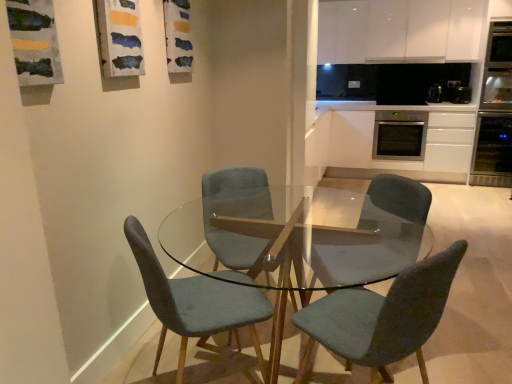
Question: Is white matte cabinet at upper center, which is counted as the 1th cabinetry, starting from the top, at the left side of satin white cabinet at right, acting as the 2th cabinetry starting from the top?

Choices:
 (A) yes
 (B) no

Answer: (A)

Question: Is white matte cabinet at upper center, which is counted as the 1th cabinetry, starting from the top, oriented away from satin white cabinet at right, acting as the first cabinetry starting from the bottom?

Choices:
 (A) yes
 (B) no

Answer: (B)

Question: Can you confirm if white matte cabinet at upper center, which is counted as the second cabinetry, starting from the bottom, is bigger than satin white cabinet at right, acting as the first cabinetry starting from the bottom?

Choices:
 (A) yes
 (B) no

Answer: (B)

Question: Does white matte cabinet at upper center, which is counted as the 1th cabinetry, starting from the top, have a lesser height compared to satin white cabinet at right, acting as the first cabinetry starting from the bottom?

Choices:
 (A) yes
 (B) no

Answer: (A)

Question: From the image's perspective, is white matte cabinet at upper center, which is counted as the 1th cabinetry, starting from the top, below satin white cabinet at right, acting as the 2th cabinetry starting from the top?

Choices:
 (A) yes
 (B) no

Answer: (B)

Question: Is white matte cabinet at upper center, which is counted as the second cabinetry, starting from the bottom, at the right side of satin white cabinet at right, acting as the first cabinetry starting from the bottom?

Choices:
 (A) yes
 (B) no

Answer: (B)

Question: Considering the relative sizes of satin black oven at right, which is the 1th appliance from left to right, and velvet teal chair at center, the first chair viewed from the right, in the image provided, is satin black oven at right, which is the 1th appliance from left to right, shorter than velvet teal chair at center, the first chair viewed from the right,?

Choices:
 (A) yes
 (B) no

Answer: (A)

Question: From a real-world perspective, is satin black oven at right, placed as the 3th appliance when sorted from right to left, physically below velvet teal chair at center, the third chair when ordered from left to right?

Choices:
 (A) yes
 (B) no

Answer: (B)

Question: Is satin black oven at right, which is the 1th appliance from left to right, aimed at velvet teal chair at center, the first chair viewed from the right?

Choices:
 (A) yes
 (B) no

Answer: (A)

Question: From the image's perspective, is satin black oven at right, placed as the 3th appliance when sorted from right to left, above velvet teal chair at center, the third chair when ordered from left to right?

Choices:
 (A) no
 (B) yes

Answer: (B)

Question: Can you confirm if satin black oven at right, placed as the 3th appliance when sorted from right to left, is thinner than velvet teal chair at center, the first chair viewed from the right?

Choices:
 (A) yes
 (B) no

Answer: (A)

Question: Is the position of satin black oven at right, which is the 1th appliance from left to right, less distant than that of velvet teal chair at center, the third chair when ordered from left to right?

Choices:
 (A) no
 (B) yes

Answer: (A)

Question: Considering the relative sizes of stainless steel oven at center-right and black plastic toaster at upper right, acting as the 2th appliance starting from the left, in the image provided, is stainless steel oven at center-right taller than black plastic toaster at upper right, acting as the 2th appliance starting from the left,?

Choices:
 (A) no
 (B) yes

Answer: (B)